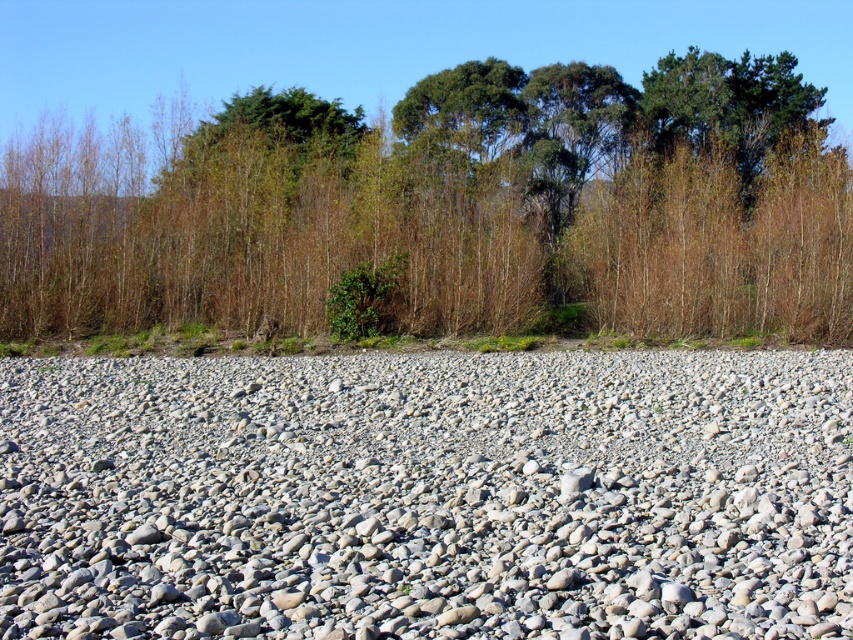
Question: Can you confirm if gray gravel at center is thinner than brown wood tree at upper center?

Choices:
 (A) yes
 (B) no

Answer: (A)

Question: Among these objects, which one is nearest to the camera?

Choices:
 (A) brown wood tree at upper center
 (B) gray gravel at center

Answer: (B)

Question: Does gray gravel at center appear over brown wood tree at upper center?

Choices:
 (A) yes
 (B) no

Answer: (B)

Question: Does gray gravel at center have a larger size compared to brown wood tree at upper center?

Choices:
 (A) yes
 (B) no

Answer: (B)

Question: Among these objects, which one is nearest to the camera?

Choices:
 (A) gray gravel at center
 (B) brown wood tree at upper center

Answer: (A)